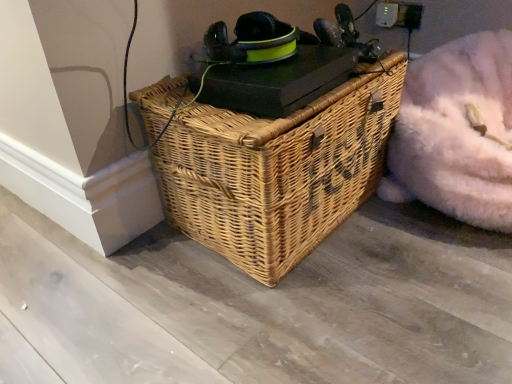
Question: From a real-world perspective, is fluffy white bean bag at lower right positioned above or below natural wicker picnic basket at center?

Choices:
 (A) below
 (B) above

Answer: (A)

Question: Is fluffy white bean bag at lower right situated inside natural wicker picnic basket at center or outside?

Choices:
 (A) inside
 (B) outside

Answer: (B)

Question: From the image's perspective, is fluffy white bean bag at lower right positioned above or below natural wicker picnic basket at center?

Choices:
 (A) above
 (B) below

Answer: (A)

Question: Considering the positions of natural wicker picnic basket at center and fluffy white bean bag at lower right in the image, is natural wicker picnic basket at center wider or thinner than fluffy white bean bag at lower right?

Choices:
 (A) thin
 (B) wide

Answer: (A)

Question: From their relative heights in the image, would you say natural wicker picnic basket at center is taller or shorter than fluffy white bean bag at lower right?

Choices:
 (A) short
 (B) tall

Answer: (B)

Question: Considering their positions, is natural wicker picnic basket at center located in front of or behind fluffy white bean bag at lower right?

Choices:
 (A) front
 (B) behind

Answer: (A)

Question: Is point (195, 134) positioned closer to the camera than point (402, 97)?

Choices:
 (A) farther
 (B) closer

Answer: (B)